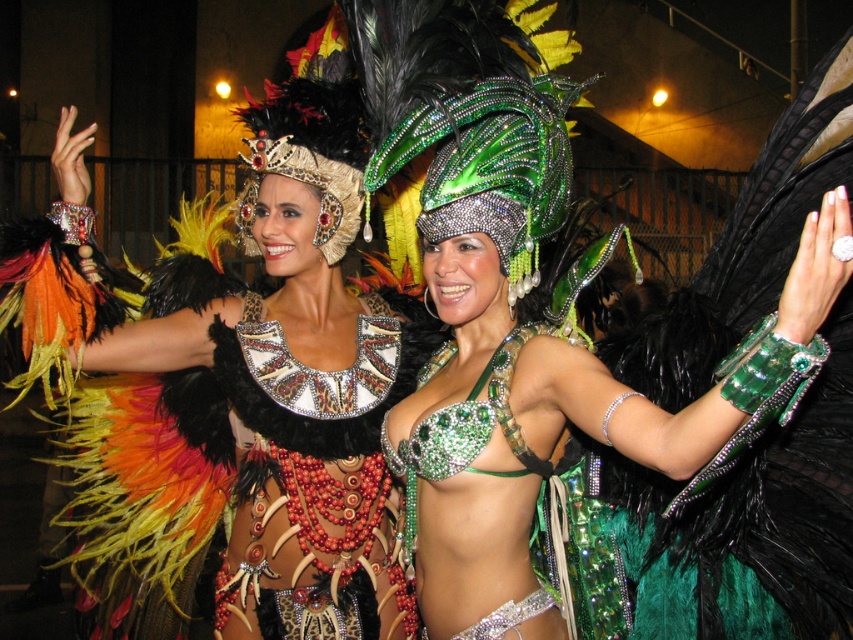
You are standing at the point marked as point (x=154, y=461) and want to take a photo of the two people in the carnival costumes. The camera you are using has a maximum focus range of 12 feet. Will the camera be able to focus on the people?

The distance between you and the people is 10.94 feet, which is within the camera maximum focus range of 12 feet. The camera can focus on the people.